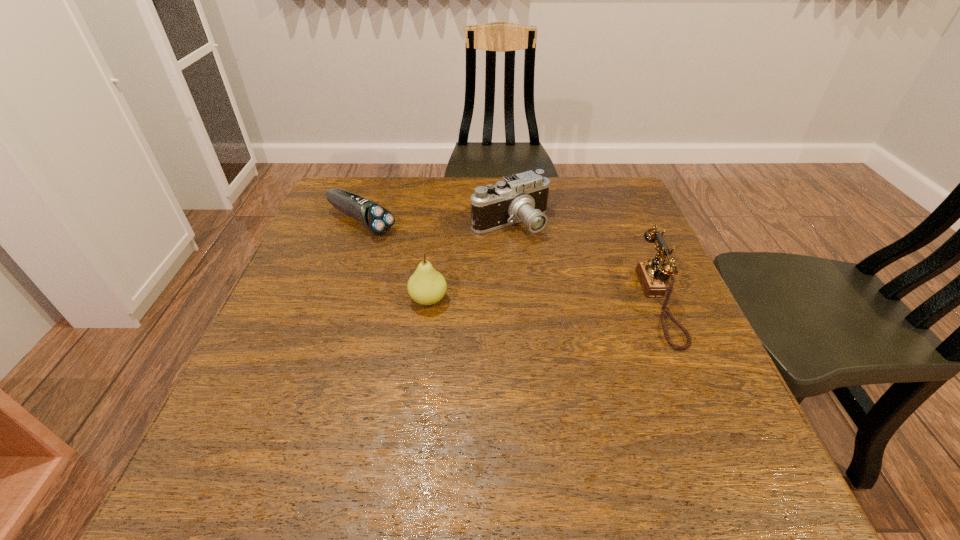
Locate an element on the screen. the third object from right to left is located at coordinates (426, 286).

Locate an element on the screen. the rightmost object is located at coordinates (652, 277).

The width and height of the screenshot is (960, 540). What are the coordinates of `the leftmost object` in the screenshot? It's located at (376, 219).

Identify the location of the shortest object. Image resolution: width=960 pixels, height=540 pixels. (376, 219).

This screenshot has width=960, height=540. What are the coordinates of `camera` in the screenshot? It's located at (522, 197).

Find the location of `vacant position located on the back of the pear`. vacant position located on the back of the pear is located at coordinates (437, 232).

The width and height of the screenshot is (960, 540). I want to click on free location located 0.390m on the head of the shortest object, so click(x=512, y=299).

Find the location of a particular element. free space located 0.190m on the head of the shortest object is located at coordinates click(x=443, y=263).

Where is `vacant region located 0.080m on the head of the shortest object`? vacant region located 0.080m on the head of the shortest object is located at coordinates (410, 246).

Where is `vacant region located 0.370m at the lens of the camera`? This screenshot has height=540, width=960. vacant region located 0.370m at the lens of the camera is located at coordinates (601, 350).